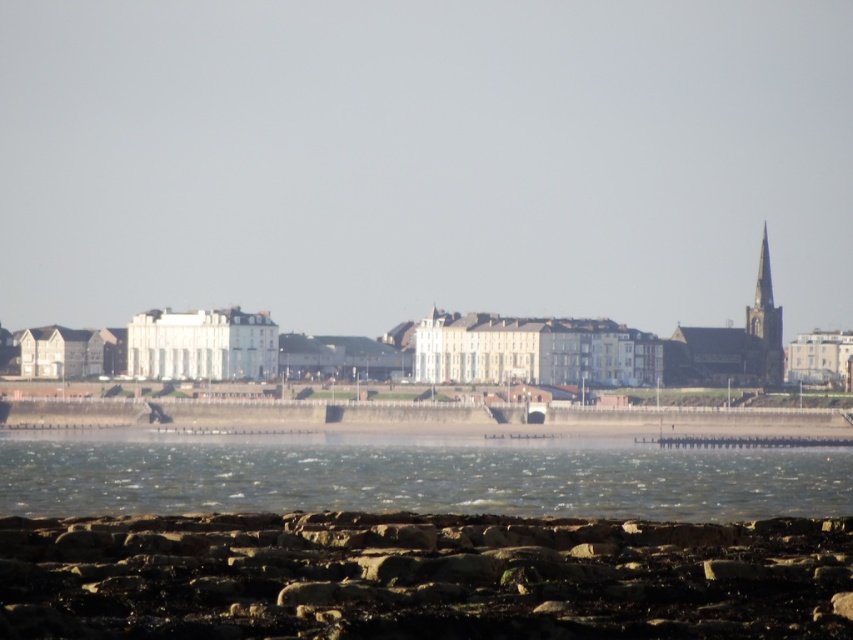
You are a photographer standing at the edge of the rocky shoreline. You want to capture a photo that includes both the rusty stone rocks at lower center and the clear water at lower center. Based on their spatial relationship, which object will occupy more of the frame in your photo?

The clear water at lower center occupies more of the frame because it occupies more space than the rusty stone rocks at lower center.

You are standing on the shore looking at the coastal scene. You notice the rusty stone rocks at lower center and the clear water at lower center. Which of these two objects is taller?

The rusty stone rocks at lower center are taller than the clear water at lower center according to the description provided.